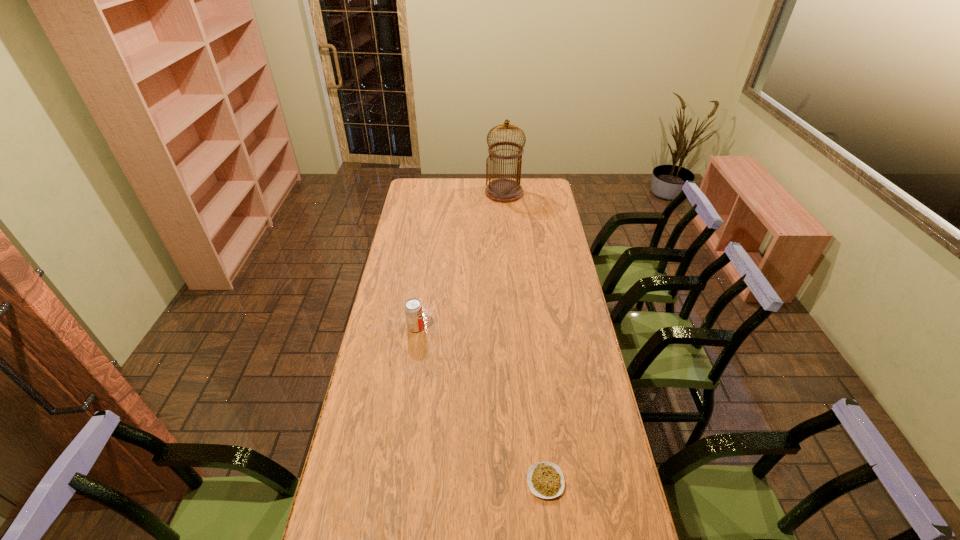
Where is `the tallest object`? the tallest object is located at coordinates (501, 190).

Locate an element on the screen. the farthest object is located at coordinates (501, 190).

The width and height of the screenshot is (960, 540). I want to click on the second shortest object, so click(x=413, y=308).

Locate an element on the screen. the second nearest object is located at coordinates (413, 308).

Identify the location of legume. The width and height of the screenshot is (960, 540). (545, 479).

In order to click on the nearest object in this screenshot , I will do `click(545, 479)`.

At what (x,y) coordinates should I click in order to perform the action: click on free space located on the front-facing side of the tallest object. Please return your answer as a coordinate pair (x, y). The width and height of the screenshot is (960, 540). Looking at the image, I should click on (508, 244).

Identify the location of free space located on the right of the second shortest object. The height and width of the screenshot is (540, 960). (476, 327).

This screenshot has width=960, height=540. I want to click on vacant space located 0.220m on the back of the nearest object, so click(x=537, y=399).

The image size is (960, 540). I want to click on object located in the far edge section of the desktop, so click(501, 190).